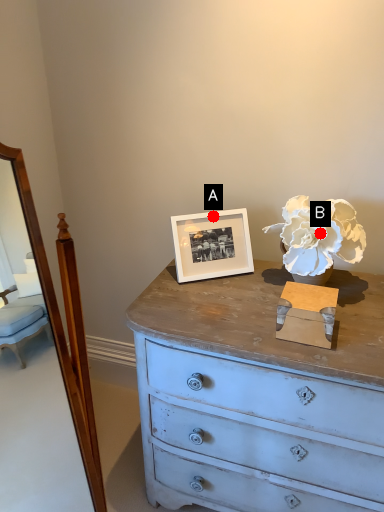
Question: Two points are circled on the image, labeled by A and B beside each circle. Which point appears farthest from the camera in this image?

Choices:
 (A) A is further
 (B) B is further

Answer: (A)